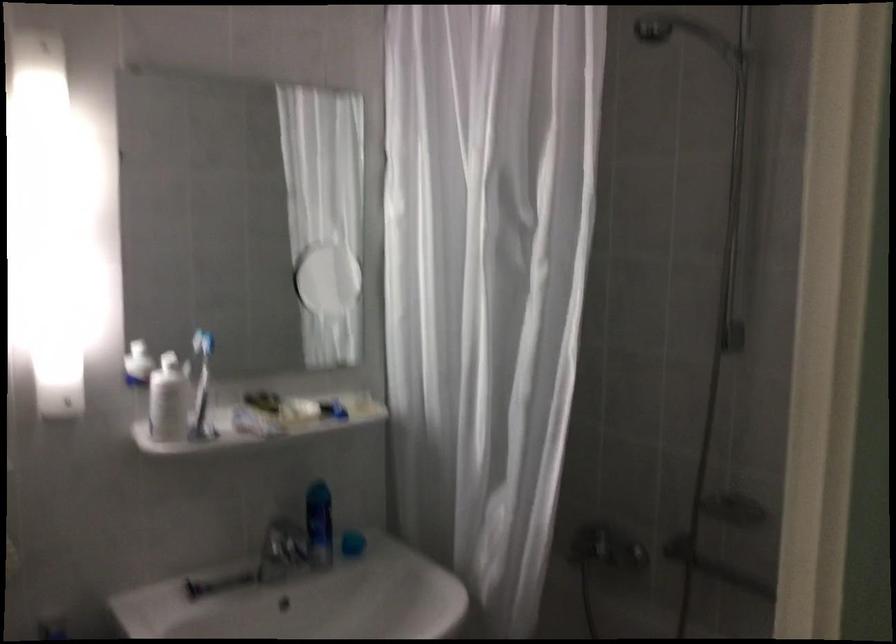
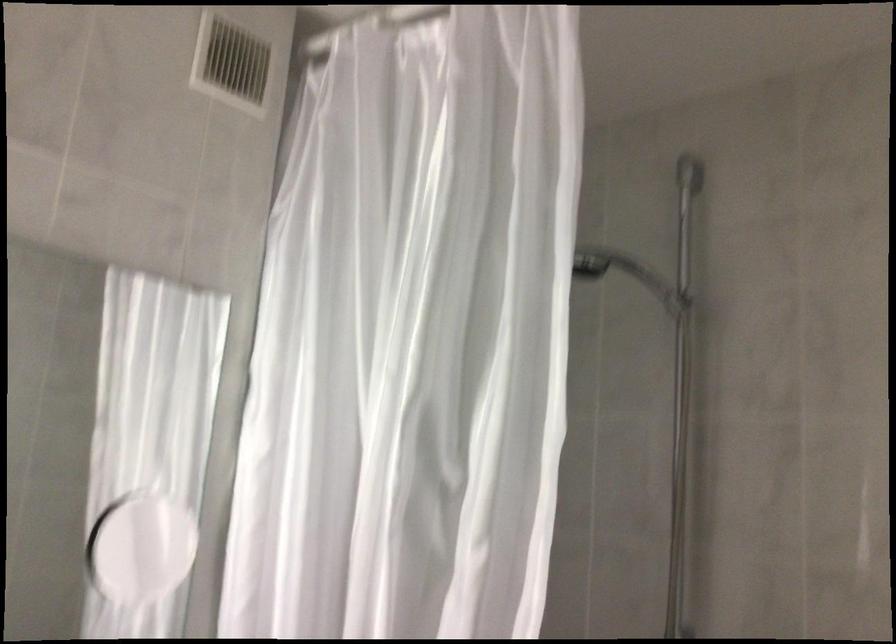
Where in the second image is the point corresponding to the point at 332,289 from the first image?

(141, 547)